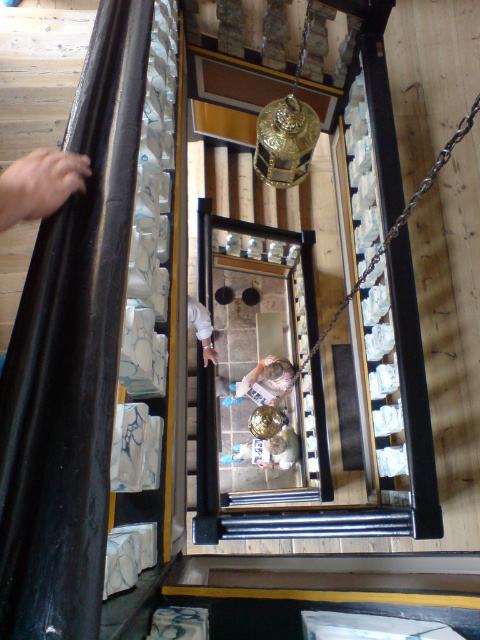
Which is behind, point (6, 216) or point (267, 392)?

Positioned behind is point (267, 392).

Describe the element at coordinates (39, 184) in the screenshot. This screenshot has width=480, height=640. I see `smooth skin hand at upper left` at that location.

What do you see at coordinates (39, 184) in the screenshot? The width and height of the screenshot is (480, 640). I see `smooth skin hand at upper left` at bounding box center [39, 184].

Where is `smooth skin hand at upper left`? smooth skin hand at upper left is located at coordinates (39, 184).

Which of these two, white fabric shirt at center or white fabric at center, stands taller?

Standing taller between the two is white fabric shirt at center.

Is white fabric shirt at center closer to the viewer compared to white fabric at center?

That is False.

Which is in front, point (275, 458) or point (204, 326)?

Point (204, 326) is in front.

This screenshot has width=480, height=640. I want to click on white fabric shirt at center, so click(x=268, y=451).

Is smooth skin hand at upper left shorter than white fabric shirt at center?

Indeed, smooth skin hand at upper left has a lesser height compared to white fabric shirt at center.

Is smooth skin hand at upper left closer to camera compared to white fabric shirt at center?

Yes, it is.

Between point (62, 157) and point (284, 448), which one is positioned in front?

Positioned in front is point (62, 157).

Identify the location of smooth skin hand at upper left. (39, 184).